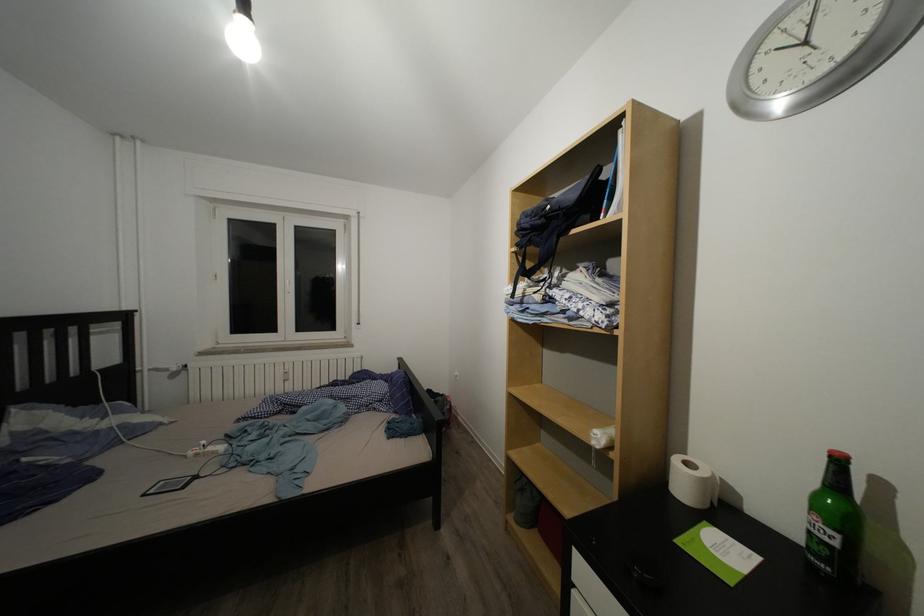
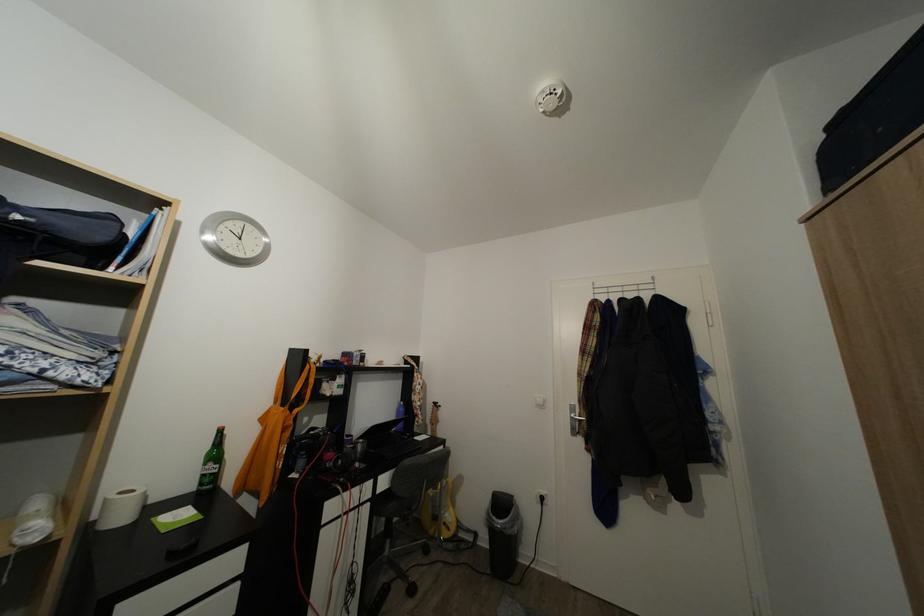
Locate, in the second image, the point that corresponds to (555,214) in the first image.

(25, 223)